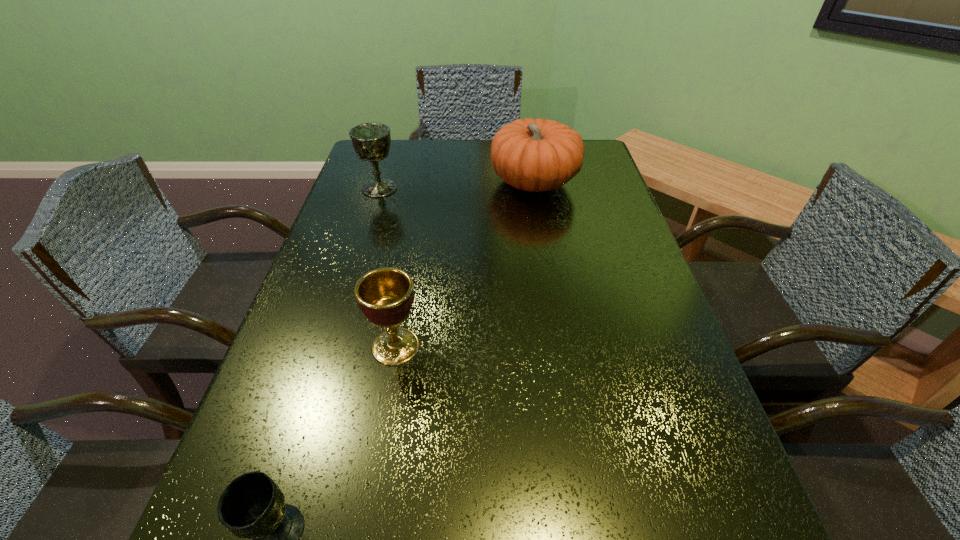
What are the coordinates of `pumpkin` in the screenshot? It's located at (535, 155).

Locate an element on the screen. the farthest chalice is located at coordinates (371, 141).

You are a GUI agent. You are given a task and a screenshot of the screen. Output one action in this format:
    pyautogui.click(x=<x>, y=<y>)
    Task: Click on the second farthest chalice
    The image size is (960, 540).
    Given the screenshot: What is the action you would take?
    pyautogui.click(x=385, y=295)

The width and height of the screenshot is (960, 540). In order to click on the rightmost chalice in this screenshot , I will do `click(385, 295)`.

The width and height of the screenshot is (960, 540). I want to click on vacant region located on the front of the rightmost object, so (x=548, y=265).

Find the location of a particular element. free location located on the right of the farthest chalice is located at coordinates (532, 188).

You are a GUI agent. You are given a task and a screenshot of the screen. Output one action in this format:
    pyautogui.click(x=<x>, y=<y>)
    Task: Click on the vacant space located 0.130m on the back of the rightmost chalice
    The height and width of the screenshot is (540, 960).
    Given the screenshot: What is the action you would take?
    pyautogui.click(x=407, y=283)

You are a GUI agent. You are given a task and a screenshot of the screen. Output one action in this format:
    pyautogui.click(x=<x>, y=<y>)
    Task: Click on the object located at the far edge
    This screenshot has width=960, height=540.
    Given the screenshot: What is the action you would take?
    pyautogui.click(x=535, y=155)

Image resolution: width=960 pixels, height=540 pixels. I want to click on object at the left edge, so click(371, 141).

Image resolution: width=960 pixels, height=540 pixels. What are the coordinates of `object at the right edge` in the screenshot? It's located at (535, 155).